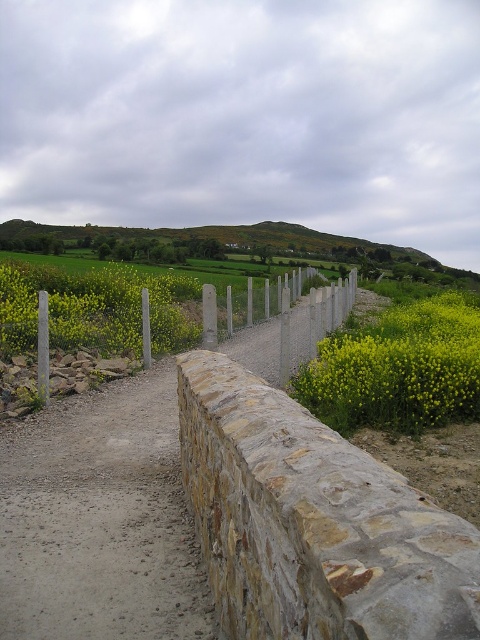
Question: Can you confirm if stone wall at center is positioned below yellow matte flowers at center?

Choices:
 (A) yes
 (B) no

Answer: (A)

Question: Which object is farther from the camera taking this photo?

Choices:
 (A) metallic chain-link fence at center
 (B) stone wall at center
 (C) yellow matte flowers at center
 (D) dusty gravel path at center

Answer: (A)

Question: Can you confirm if stone wall at center is wider than stone textured wall at center?

Choices:
 (A) no
 (B) yes

Answer: (A)

Question: Which point is farther from the camera taking this photo?

Choices:
 (A) (225, 627)
 (B) (128, 337)

Answer: (B)

Question: Where is stone textured wall at center located in relation to metallic chain-link fence at center in the image?

Choices:
 (A) below
 (B) above

Answer: (A)

Question: Among these objects, which one is farthest from the camera?

Choices:
 (A) stone wall at center
 (B) dusty gravel path at center
 (C) yellow matte flowers at center

Answer: (C)